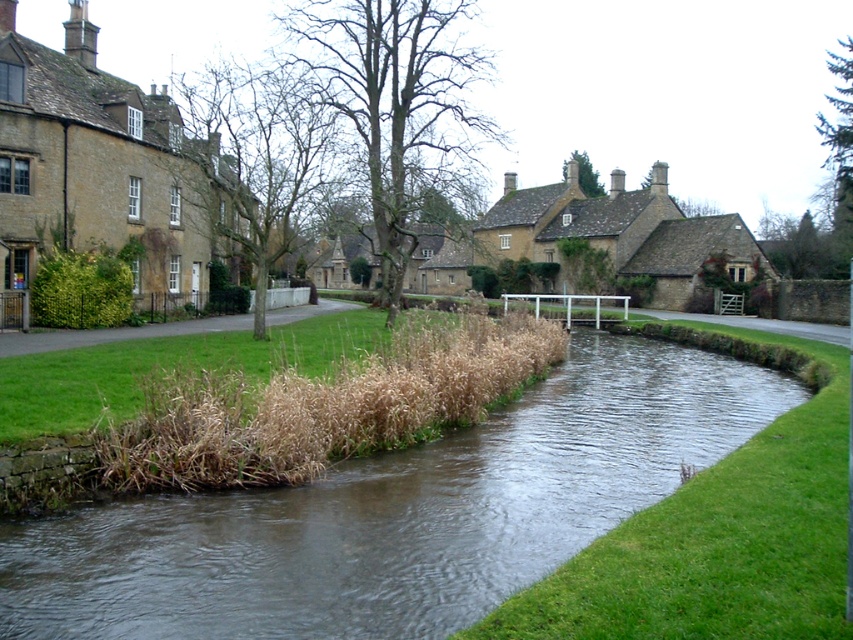
You are standing at the point labeled point (x=605, y=433) and want to walk towards the point labeled point (x=668, y=129). Since both points are in the same scene, which direction should you face to move towards your destination?

You should face away from the viewer because point (x=668, y=129) is further away than point (x=605, y=433).

You are planning to cross the river using a wooden plank that is 3 meters long. Given the scene described, will the plank be sufficient to bridge the brown grassy stream at center and the matte stone houses at center?

The brown grassy stream at center is narrower than the matte stone houses at center, but the exact width isn

You are a delivery drone flying over a rural area and need to land on the brown grassy stream at center. However, you must avoid hitting the matte stone houses at center. Based on the scene description, can you safely land there without colliding with the houses?

The brown grassy stream at center has a lesser height compared to matte stone houses at center. Since the stream is lower than the houses, the drone can safely land there without colliding with the houses.